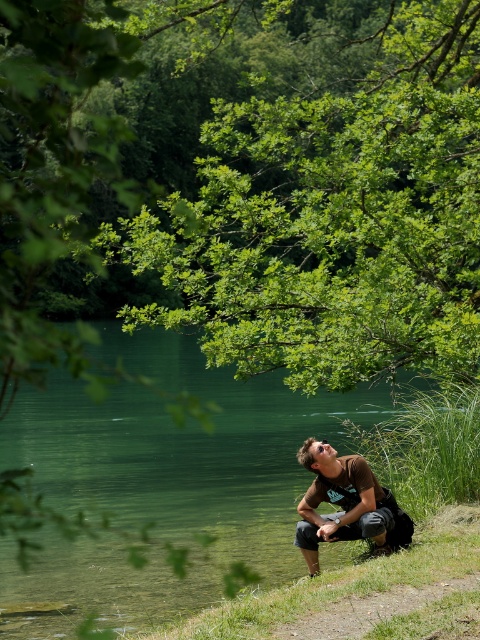
Question: Which of the following is the closest to the observer?

Choices:
 (A) (300, 545)
 (B) (127, 492)

Answer: (A)

Question: In this image, where is green translucent water at lower left located relative to brown cotton shirt at center?

Choices:
 (A) below
 (B) above

Answer: (B)

Question: Which object is farther from the camera taking this photo?

Choices:
 (A) green translucent water at lower left
 (B) brown cotton shirt at center

Answer: (B)

Question: Is green translucent water at lower left bigger than brown cotton shirt at center?

Choices:
 (A) yes
 (B) no

Answer: (A)

Question: Does green translucent water at lower left have a lesser width compared to brown cotton shirt at center?

Choices:
 (A) yes
 (B) no

Answer: (B)